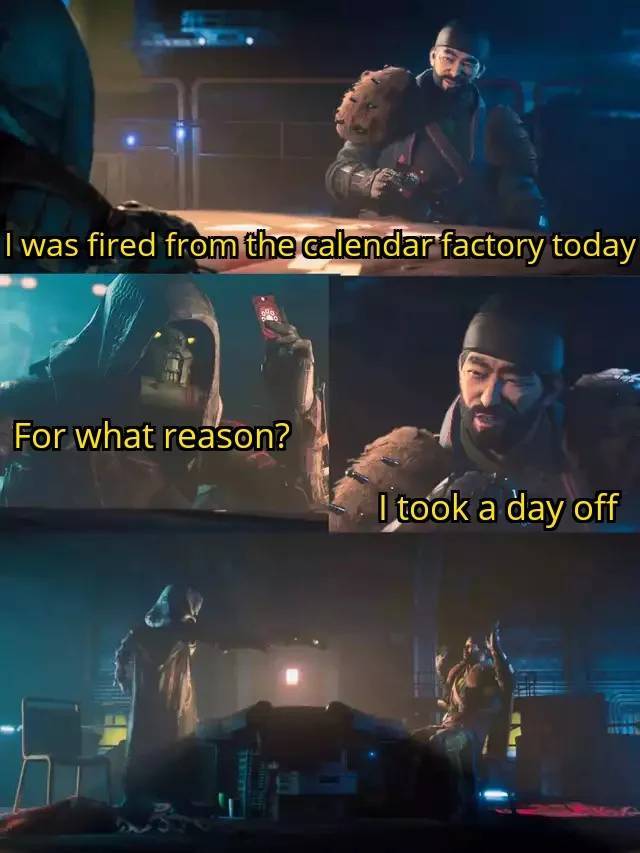
In order to click on chair in this screenshot , I will do `click(61, 722)`.